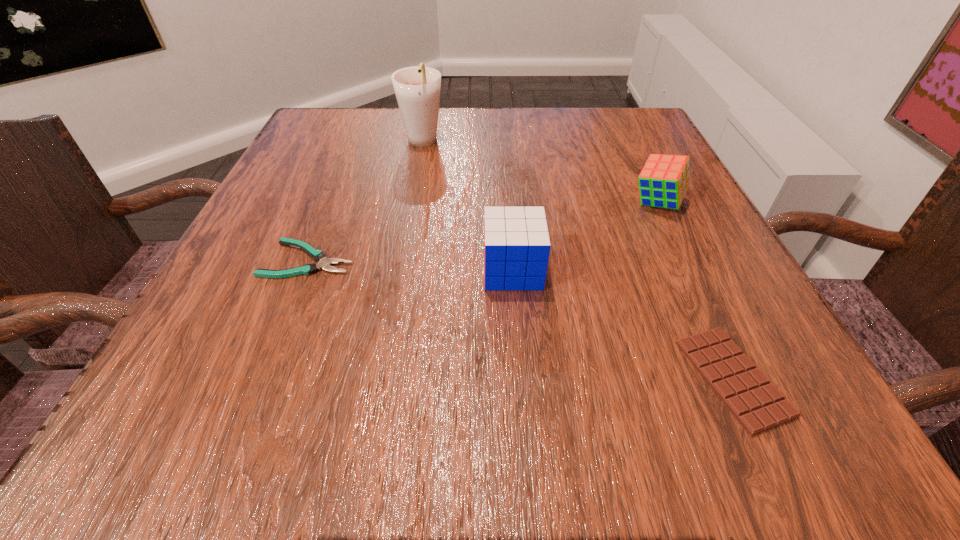
Locate an element on the screen. empty space between the nearest object and the nearer cube is located at coordinates (623, 324).

Where is `free space between the left cube and the nearest object`? The height and width of the screenshot is (540, 960). free space between the left cube and the nearest object is located at coordinates (623, 324).

Where is `vacant area that lies between the nearer cube and the leftmost object`? Image resolution: width=960 pixels, height=540 pixels. vacant area that lies between the nearer cube and the leftmost object is located at coordinates (411, 265).

Identify the location of free space between the fourth nearest object and the nearest object. The image size is (960, 540). (695, 291).

Locate which object is the fourth closest to the second farthest object. Please provide its 2D coordinates. Your answer should be formatted as a tuple, i.e. [(x, y)], where the tuple contains the x and y coordinates of a point satisfying the conditions above.

[(318, 255)]

Locate which object ranks fourth in proximity to the tallest object. Please provide its 2D coordinates. Your answer should be formatted as a tuple, i.e. [(x, y)], where the tuple contains the x and y coordinates of a point satisfying the conditions above.

[(757, 404)]

You are a GUI agent. You are given a task and a screenshot of the screen. Output one action in this format:
    pyautogui.click(x=<x>, y=<y>)
    Task: Click on the blank area in the image that satisfies the following two spatial constraints: 1. on the drink side of the second farthest object; 2. on the right side of the root beer
    The width and height of the screenshot is (960, 540).
    Given the screenshot: What is the action you would take?
    pyautogui.click(x=411, y=202)

I want to click on blank space that satisfies the following two spatial constraints: 1. on the drink side of the nearest object; 2. on the left side of the farthest object, so click(377, 378).

At what (x,y) coordinates should I click in order to perform the action: click on vacant space that satisfies the following two spatial constraints: 1. on the back side of the left cube; 2. on the right side of the right cube. Please return your answer as a coordinate pair (x, y). Looking at the image, I should click on coord(508,202).

Image resolution: width=960 pixels, height=540 pixels. I want to click on blank area in the image that satisfies the following two spatial constraints: 1. on the drink side of the candy bar; 2. on the left side of the farthest object, so click(x=377, y=378).